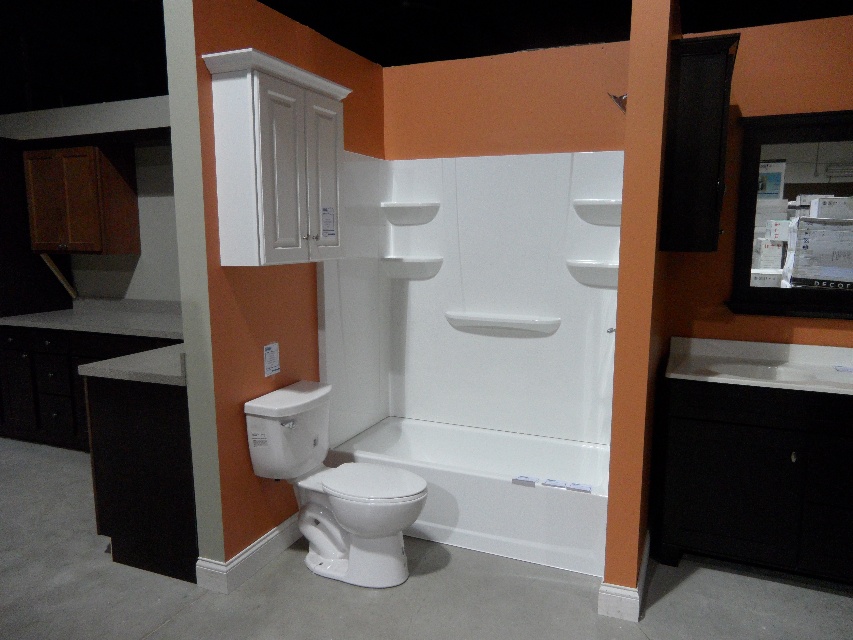
Question: Does white glossy toilet at lower center appear on the left side of white glossy toilet at center?

Choices:
 (A) no
 (B) yes

Answer: (B)

Question: Based on their relative distances, which object is farther from the matte black medicine cabinet at upper right?

Choices:
 (A) white glossy toilet at center
 (B) white glossy toilet at lower center

Answer: (B)

Question: Is white glossy toilet at lower center to the left of white glossy toilet at center from the viewer's perspective?

Choices:
 (A) yes
 (B) no

Answer: (A)

Question: Among these objects, which one is farthest from the camera?

Choices:
 (A) white glossy toilet at center
 (B) matte black medicine cabinet at upper right
 (C) white glossy toilet at lower center

Answer: (B)

Question: Is matte black medicine cabinet at upper right thinner than white glossy toilet at center?

Choices:
 (A) no
 (B) yes

Answer: (B)

Question: Which point is closer to the camera taking this photo?

Choices:
 (A) (386, 467)
 (B) (753, 140)
 (C) (384, 490)

Answer: (C)